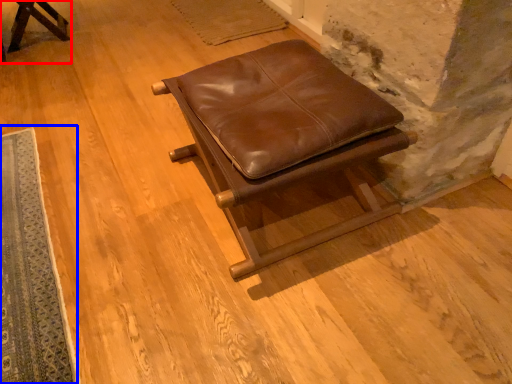
Question: Which object appears closest to the camera in this image, furniture (highlighted by a red box) or mat (highlighted by a blue box)?

Choices:
 (A) furniture
 (B) mat

Answer: (B)